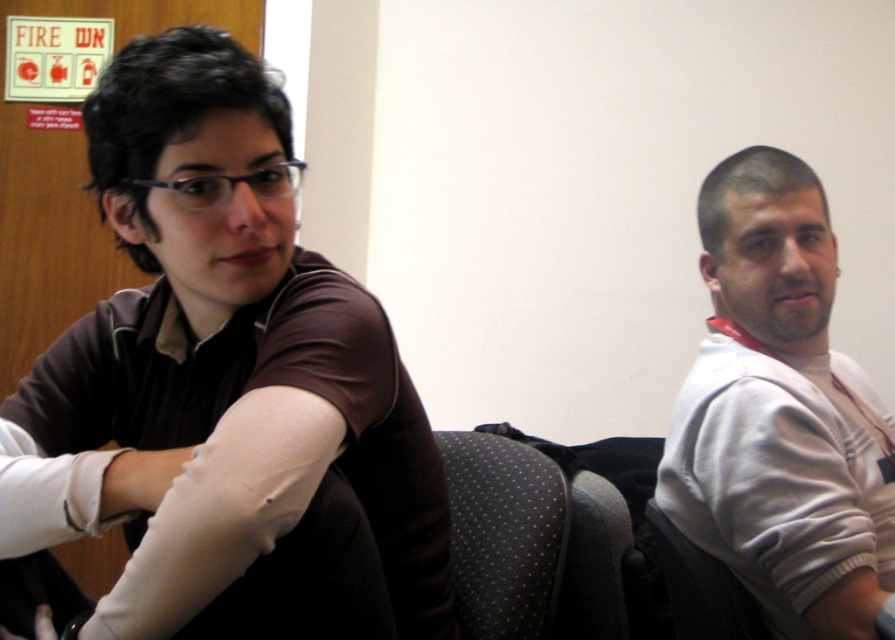
Question: Which is nearer to the dark fabric armchair at center?

Choices:
 (A) white matte skin at lower right
 (B) white matte bandage at lower left
 (C) white fleece jacket at right

Answer: (C)

Question: Does dark fabric armchair at center appear under white matte hand at lower left?

Choices:
 (A) yes
 (B) no

Answer: (B)

Question: Which object is farther from the camera taking this photo?

Choices:
 (A) white matte skin at lower right
 (B) white fleece arm at right
 (C) white fleece jacket at right
 (D) white matte hand at lower left

Answer: (C)

Question: From the image, what is the correct spatial relationship of white matte skin at lower right in relation to white matte hand at lower left?

Choices:
 (A) below
 (B) above

Answer: (A)

Question: Which point is closer to the camera?

Choices:
 (A) (857, 637)
 (B) (118, 481)
 (C) (785, 429)
 (D) (499, 589)

Answer: (B)

Question: From the image, what is the correct spatial relationship of white fleece arm at right in relation to white matte skin at lower right?

Choices:
 (A) above
 (B) below

Answer: (A)